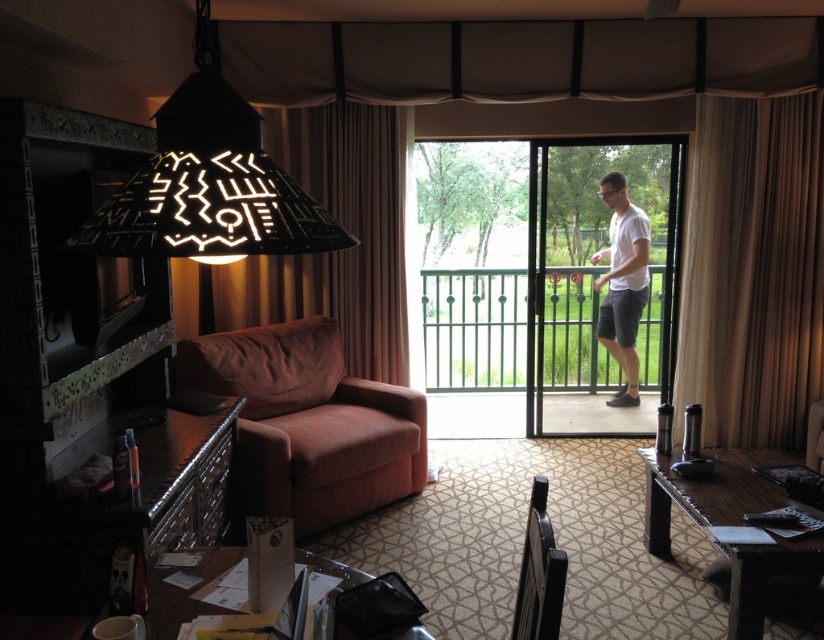
Does black matte lampshade at upper left have a larger size compared to white cotton t-shirt at center?

Incorrect, black matte lampshade at upper left is not larger than white cotton t-shirt at center.

Does black matte lampshade at upper left lie in front of white cotton t-shirt at center?

Yes, it is in front of white cotton t-shirt at center.

Locate an element on the screen. This screenshot has height=640, width=824. black matte lampshade at upper left is located at coordinates (208, 182).

Locate an element on the screen. black matte lampshade at upper left is located at coordinates (208, 182).

Does clear glass screen door at center come behind white cotton t-shirt at center?

No, it is not.

Based on the photo, who is lower down, clear glass screen door at center or white cotton t-shirt at center?

white cotton t-shirt at center

Between point (542, 211) and point (607, 195), which one is positioned in front?

Point (607, 195) is in front.

Locate an element on the screen. The width and height of the screenshot is (824, 640). clear glass screen door at center is located at coordinates click(x=537, y=275).

Is brown fabric armchair at lower left positioned at the back of black matte lampshade at upper left?

That is True.

Does brown fabric armchair at lower left have a lesser height compared to black matte lampshade at upper left?

In fact, brown fabric armchair at lower left may be taller than black matte lampshade at upper left.

Measure the distance between point [366,397] and camera.

Point [366,397] is 4.04 meters away from camera.

You are a GUI agent. You are given a task and a screenshot of the screen. Output one action in this format:
    pyautogui.click(x=<x>, y=<y>)
    Task: Click on the brown fabric armchair at lower left
    The width and height of the screenshot is (824, 640).
    Given the screenshot: What is the action you would take?
    pyautogui.click(x=309, y=422)